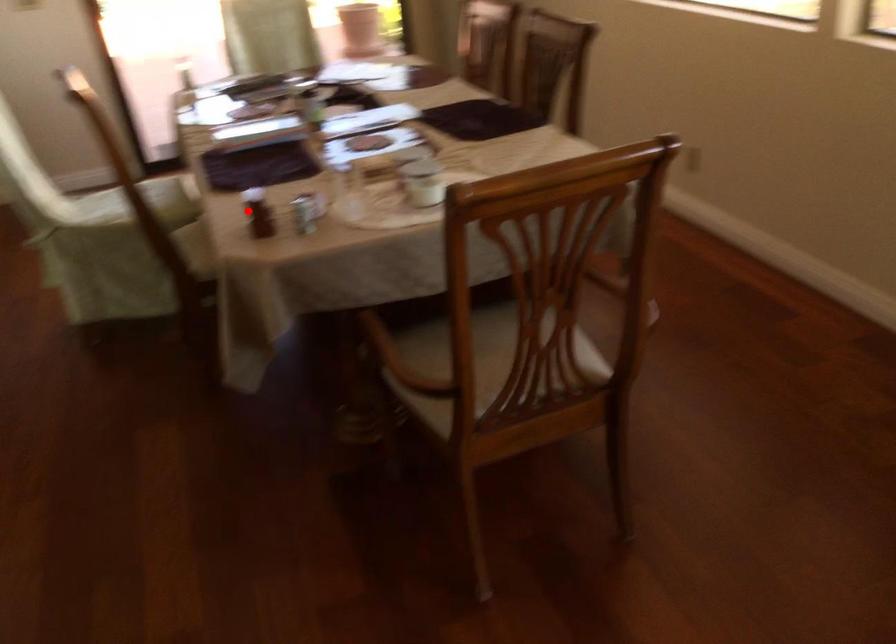
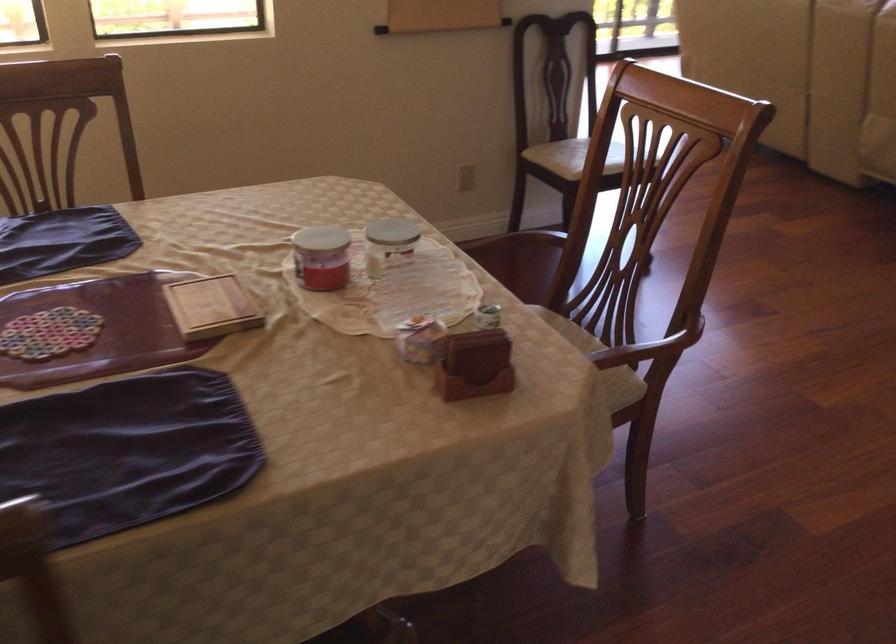
Question: I am providing you with two images of the same scene from different viewpoints. A red point is marked on the first image. Can you still see the location of the red point in image 2?

Choices:
 (A) Yes
 (B) No

Answer: (A)